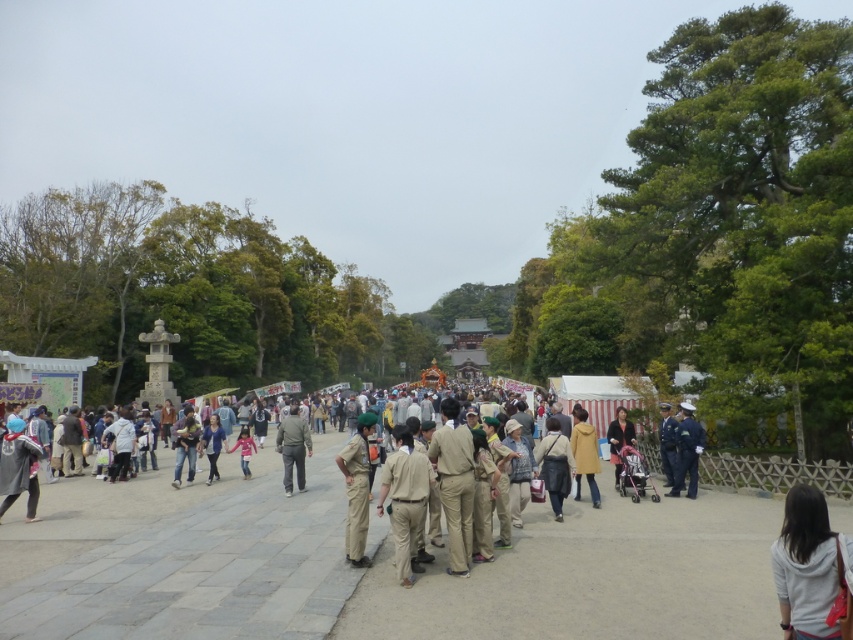
Question: Observing the image, what is the correct spatial positioning of blue uniform at center in reference to blue uniform at right?

Choices:
 (A) right
 (B) left

Answer: (A)

Question: Is khaki uniform at center above matte brown coat at center?

Choices:
 (A) no
 (B) yes

Answer: (A)

Question: Is khaki uniform pants at center thinner than light brown fabric coat at center?

Choices:
 (A) yes
 (B) no

Answer: (B)

Question: Among these points, which one is nearest to the camera?

Choices:
 (A) (293, 440)
 (B) (27, 513)
 (C) (554, 481)
 (D) (415, 540)

Answer: (D)

Question: Which point is farther to the camera?

Choices:
 (A) (792, 636)
 (B) (287, 420)
 (C) (355, 438)

Answer: (B)

Question: Among these points, which one is nearest to the camera?

Choices:
 (A) (569, 476)
 (B) (412, 477)

Answer: (B)